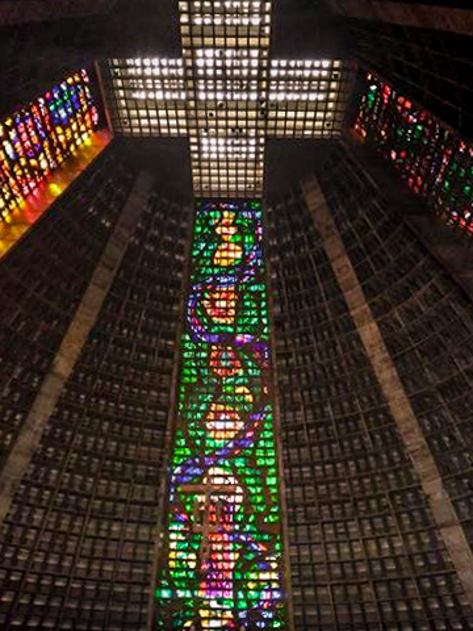
This screenshot has height=631, width=473. Find the location of `floral pattern`. floral pattern is located at coordinates (227, 425), (223, 479), (223, 361), (220, 310), (227, 302), (229, 251), (223, 226).